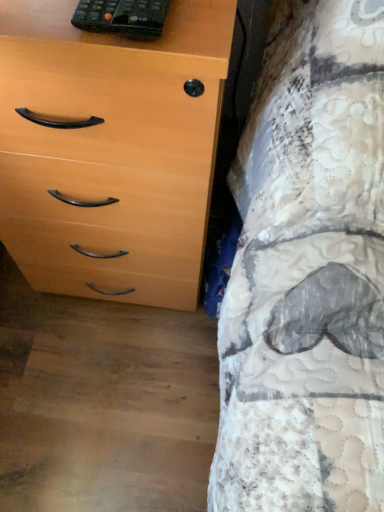
The width and height of the screenshot is (384, 512). I want to click on light wood/veneer chest of drawers at left, so click(110, 150).

What is the approximate height of light wood/veneer chest of drawers at left?

light wood/veneer chest of drawers at left is 29.25 inches in height.

What do you see at coordinates (110, 150) in the screenshot? I see `light wood/veneer chest of drawers at left` at bounding box center [110, 150].

From the picture: In order to face black plastic remote at upper left, should I rotate leftwards or rightwards?

To align with it, rotate left about 10.293°.

Locate an element on the screen. The height and width of the screenshot is (512, 384). black plastic remote at upper left is located at coordinates (122, 17).

The width and height of the screenshot is (384, 512). Describe the element at coordinates (122, 17) in the screenshot. I see `black plastic remote at upper left` at that location.

At what (x,y) coordinates should I click in order to perform the action: click on light wood/veneer chest of drawers at left. Please return your answer as a coordinate pair (x, y). Looking at the image, I should click on (110, 150).

Does light wood/veneer chest of drawers at left appear on the left side of black plastic remote at upper left?

Correct, you'll find light wood/veneer chest of drawers at left to the left of black plastic remote at upper left.

Does light wood/veneer chest of drawers at left lie in front of black plastic remote at upper left?

Yes.

Is point (76, 271) behind point (86, 14)?

Yes, point (76, 271) is behind point (86, 14).

From the image's perspective, is light wood/veneer chest of drawers at left located above or below black plastic remote at upper left?

Based on their image positions, light wood/veneer chest of drawers at left is located beneath black plastic remote at upper left.

From a real-world perspective, is light wood/veneer chest of drawers at left physically above black plastic remote at upper left?

Incorrect, from a real-world perspective, light wood/veneer chest of drawers at left is lower than black plastic remote at upper left.

Can you confirm if light wood/veneer chest of drawers at left is thinner than black plastic remote at upper left?

No, light wood/veneer chest of drawers at left is not thinner than black plastic remote at upper left.

Is light wood/veneer chest of drawers at left taller or shorter than black plastic remote at upper left?

In the image, light wood/veneer chest of drawers at left appears to be taller than black plastic remote at upper left.

Is light wood/veneer chest of drawers at left smaller than black plastic remote at upper left?

Actually, light wood/veneer chest of drawers at left might be larger than black plastic remote at upper left.

Which is correct: light wood/veneer chest of drawers at left is inside black plastic remote at upper left, or outside of it?

light wood/veneer chest of drawers at left is outside black plastic remote at upper left.

Is light wood/veneer chest of drawers at left in contact with black plastic remote at upper left?

No, light wood/veneer chest of drawers at left is not beside black plastic remote at upper left.

Is light wood/veneer chest of drawers at left aimed at black plastic remote at upper left?

No, light wood/veneer chest of drawers at left is not turned towards black plastic remote at upper left.

This screenshot has width=384, height=512. I want to click on the chest of drawers that is under the black plastic remote at upper left (from a real-world perspective), so click(110, 150).

Which is more to the left, black plastic remote at upper left or light wood/veneer chest of drawers at left?

From the viewer's perspective, light wood/veneer chest of drawers at left appears more on the left side.

Does black plastic remote at upper left come in front of light wood/veneer chest of drawers at left?

No, it is not.

Is point (89, 7) closer or farther from the camera than point (22, 164)?

Point (89, 7).

Looking at this image, from the image's perspective, between black plastic remote at upper left and light wood/veneer chest of drawers at left, who is located below?

light wood/veneer chest of drawers at left appears lower in the image.

From a real-world perspective, which object rests below the other?

light wood/veneer chest of drawers at left, from a real-world perspective.

Can you confirm if black plastic remote at upper left is thinner than light wood/veneer chest of drawers at left?

Yes.

Between black plastic remote at upper left and light wood/veneer chest of drawers at left, which one has more height?

With more height is light wood/veneer chest of drawers at left.

Considering the sizes of objects black plastic remote at upper left and light wood/veneer chest of drawers at left in the image provided, who is smaller, black plastic remote at upper left or light wood/veneer chest of drawers at left?

black plastic remote at upper left.

Would you say black plastic remote at upper left is outside light wood/veneer chest of drawers at left?

Indeed, black plastic remote at upper left is completely outside light wood/veneer chest of drawers at left.

Are black plastic remote at upper left and light wood/veneer chest of drawers at left beside each other?

No.

Is black plastic remote at upper left facing away from light wood/veneer chest of drawers at left?

No, black plastic remote at upper left is not facing the opposite direction of light wood/veneer chest of drawers at left.

Locate an element on the screen. control that is above the light wood/veneer chest of drawers at left (from the image's perspective) is located at coordinates (122, 17).

Locate an element on the screen. the chest of drawers below the black plastic remote at upper left (from a real-world perspective) is located at coordinates (110, 150).

At what (x,y) coordinates should I click in order to perform the action: click on control that appears on the right of light wood/veneer chest of drawers at left. Please return your answer as a coordinate pair (x, y). The image size is (384, 512). Looking at the image, I should click on (122, 17).